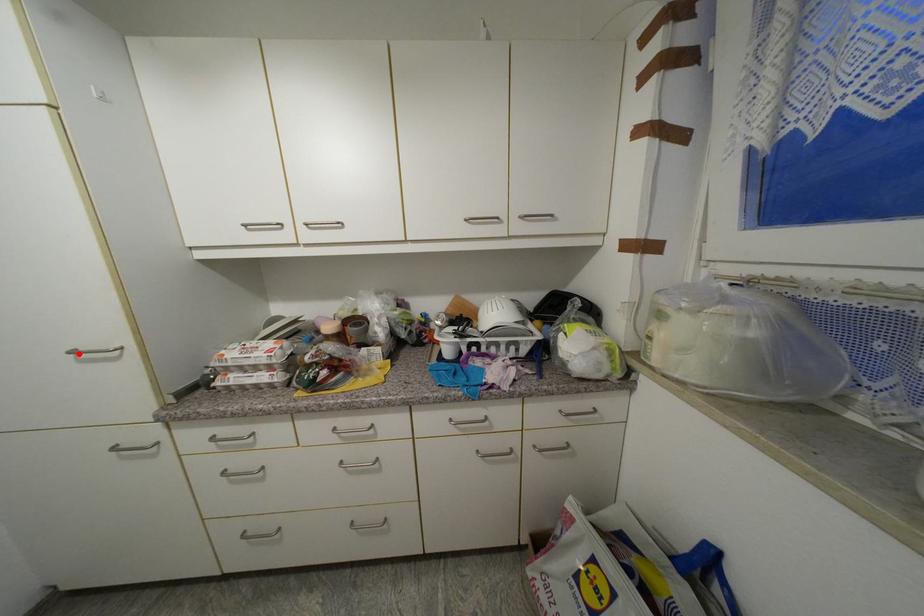
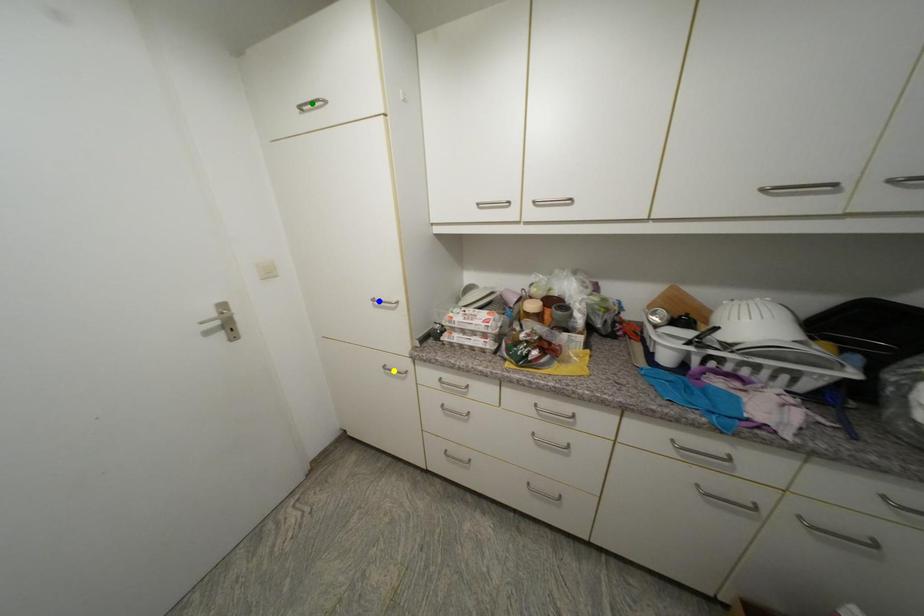
Question: I am providing you with two images of the same scene from different viewpoints. A red point is marked on the first image. You are given multiple points on the second image. Which mark in image 2 goes with the point in image 1?

Choices:
 (A) yellow point
 (B) green point
 (C) blue point

Answer: (C)